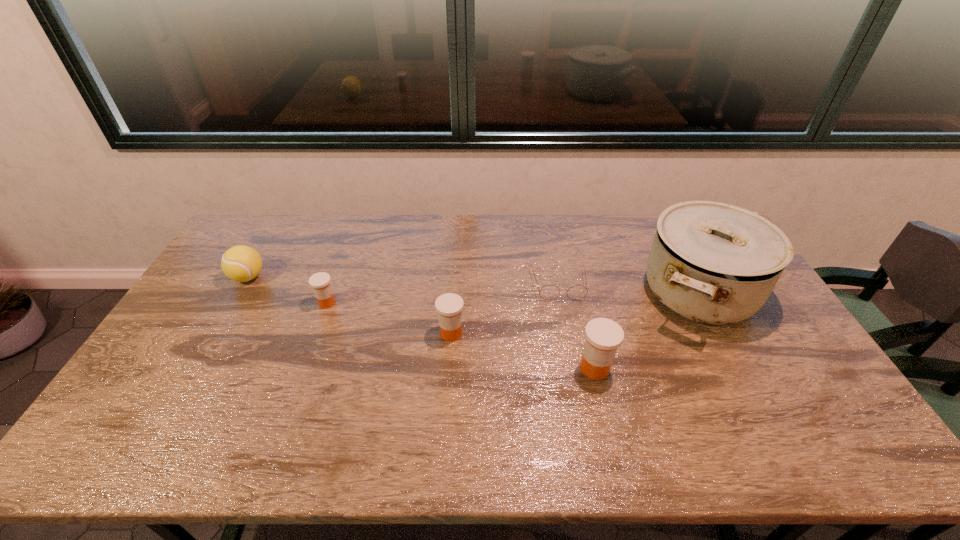
The height and width of the screenshot is (540, 960). Identify the location of object that is at the far edge. (714, 263).

At what (x,y) coordinates should I click in order to perform the action: click on object located in the left edge section of the desktop. Please return your answer as a coordinate pair (x, y). This screenshot has height=540, width=960. Looking at the image, I should click on (241, 263).

You are a GUI agent. You are given a task and a screenshot of the screen. Output one action in this format:
    pyautogui.click(x=<x>, y=<y>)
    Task: Click on the object that is positioned at the right edge
    The image size is (960, 540).
    Given the screenshot: What is the action you would take?
    pyautogui.click(x=714, y=263)

Where is `object present at the far right corner`? object present at the far right corner is located at coordinates (714, 263).

Find the location of a particular element. vacant space at the far edge is located at coordinates (401, 234).

Identify the location of vacant space at the near edge. (395, 398).

In the image, there is a desktop. Identify the location of vacant space at the left edge. The height and width of the screenshot is (540, 960). (143, 374).

You are a GUI agent. You are given a task and a screenshot of the screen. Output one action in this format:
    pyautogui.click(x=<x>, y=<y>)
    Task: Click on the free space at the right edge of the desktop
    
    Given the screenshot: What is the action you would take?
    pyautogui.click(x=754, y=366)

What are the coordinates of `free point between the second farthest medicine and the saucepan` in the screenshot? It's located at (574, 312).

Locate an element on the screen. Image resolution: width=960 pixels, height=540 pixels. free space that is in between the saucepan and the fourth object from right to left is located at coordinates (574, 312).